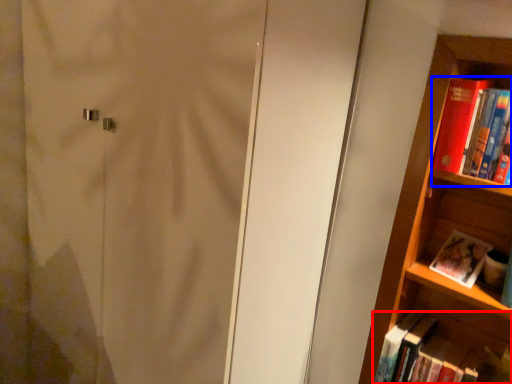
Question: Which object is further to the camera taking this photo, book (highlighted by a red box) or book (highlighted by a blue box)?

Choices:
 (A) book
 (B) book

Answer: (A)